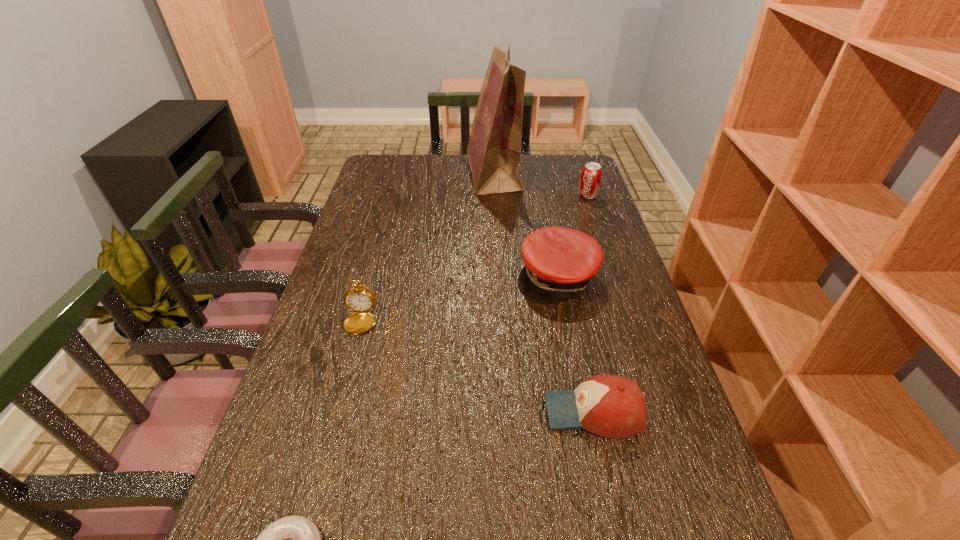
I want to click on object that ranks as the fifth closest to the third nearest object, so click(x=591, y=174).

The width and height of the screenshot is (960, 540). Identify the location of vacant area in the image that satisfies the following two spatial constraints: 1. on the back side of the rightmost object; 2. on the front-facing side of the tallest object. [581, 174].